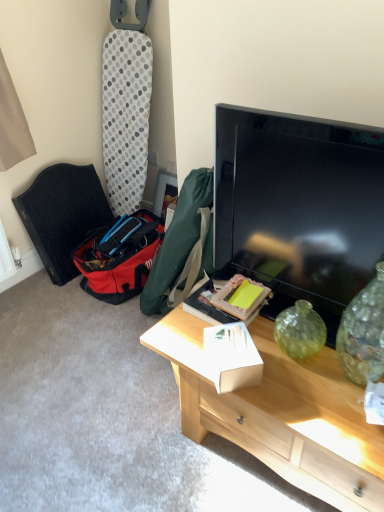
Question: Is wooden picture frame at center aimed at white cardboard box at center, arranged as the second box when viewed from the back?

Choices:
 (A) no
 (B) yes

Answer: (A)

Question: Is wooden picture frame at center behind white cardboard box at center, arranged as the first box when viewed from the front?

Choices:
 (A) yes
 (B) no

Answer: (A)

Question: Can you confirm if wooden picture frame at center is thinner than white cardboard box at center, arranged as the second box when viewed from the back?

Choices:
 (A) yes
 (B) no

Answer: (A)

Question: From the image's perspective, is wooden picture frame at center on top of white cardboard box at center, arranged as the second box when viewed from the back?

Choices:
 (A) yes
 (B) no

Answer: (A)

Question: From the image's perspective, is wooden picture frame at center under white cardboard box at center, arranged as the second box when viewed from the back?

Choices:
 (A) yes
 (B) no

Answer: (B)

Question: Considering the positions of black fabric folding chair at left and white cardboard box at center, which ranks as the 1th box in back-to-front order, in the image, is black fabric folding chair at left taller or shorter than white cardboard box at center, which ranks as the 1th box in back-to-front order,?

Choices:
 (A) tall
 (B) short

Answer: (A)

Question: Relative to white cardboard box at center, which ranks as the 1th box in back-to-front order, is black fabric folding chair at left in front or behind?

Choices:
 (A) behind
 (B) front

Answer: (A)

Question: Is point (59, 182) positioned closer to the camera than point (220, 321)?

Choices:
 (A) farther
 (B) closer

Answer: (A)

Question: Would you say black fabric folding chair at left is inside or outside white cardboard box at center, which ranks as the 1th box in back-to-front order?

Choices:
 (A) inside
 (B) outside

Answer: (B)

Question: Considering the positions of wooden picture frame at center and light wood desk at center in the image, is wooden picture frame at center taller or shorter than light wood desk at center?

Choices:
 (A) tall
 (B) short

Answer: (B)

Question: Considering their positions, is wooden picture frame at center located in front of or behind light wood desk at center?

Choices:
 (A) behind
 (B) front

Answer: (A)

Question: Which is correct: wooden picture frame at center is inside light wood desk at center, or outside of it?

Choices:
 (A) inside
 (B) outside

Answer: (B)

Question: Based on their positions, is wooden picture frame at center located to the left or right of light wood desk at center?

Choices:
 (A) left
 (B) right

Answer: (A)

Question: From the image's perspective, is flat screen tv at center located above or below black fabric folding chair at left?

Choices:
 (A) below
 (B) above

Answer: (A)

Question: Considering their positions, is flat screen tv at center located in front of or behind black fabric folding chair at left?

Choices:
 (A) front
 (B) behind

Answer: (A)